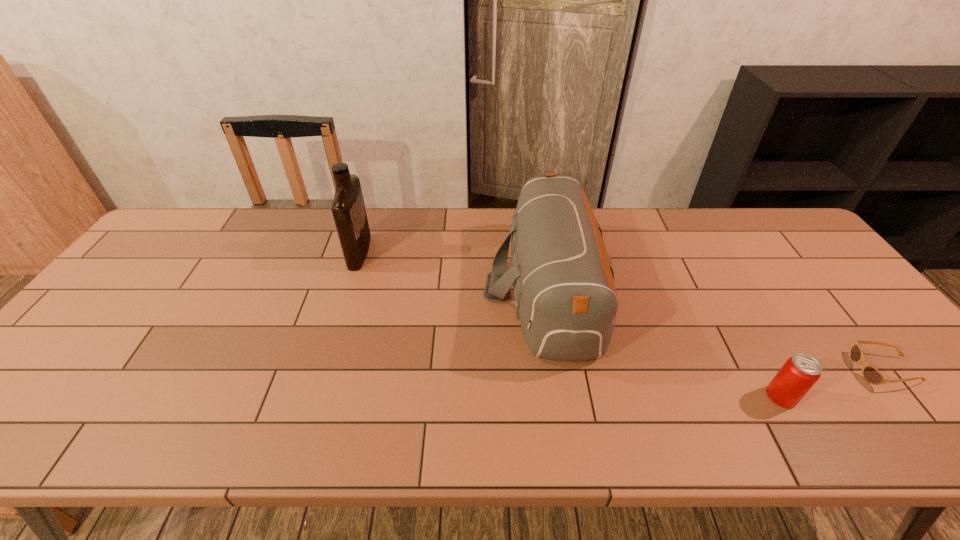
Identify the location of vacant area at the right edge of the desktop. The image size is (960, 540). (880, 356).

This screenshot has height=540, width=960. In the image, there is a desktop. Find the location of `blank space at the far left corner`. blank space at the far left corner is located at coordinates (201, 232).

Where is `vacant space that's between the second object from left to right and the liquor`? vacant space that's between the second object from left to right and the liquor is located at coordinates (452, 269).

Locate an element on the screen. free space between the sunglasses and the second tallest object is located at coordinates (715, 329).

This screenshot has height=540, width=960. Find the location of `free space that is in between the second tallest object and the liquor`. free space that is in between the second tallest object and the liquor is located at coordinates (452, 269).

Identify the location of vacant space that's between the can and the second tallest object. This screenshot has height=540, width=960. (663, 342).

The image size is (960, 540). I want to click on vacant space that is in between the rightmost object and the liquor, so click(x=622, y=310).

At what (x,y) coordinates should I click in order to perform the action: click on vacant space that is in between the third tallest object and the duffel bag. Please return your answer as a coordinate pair (x, y). Image resolution: width=960 pixels, height=540 pixels. Looking at the image, I should click on (663, 342).

Identify the location of free spot between the second object from left to right and the third tallest object. Image resolution: width=960 pixels, height=540 pixels. (663, 342).

Identify the location of vacant region between the second object from right to left and the second tallest object. (663, 342).